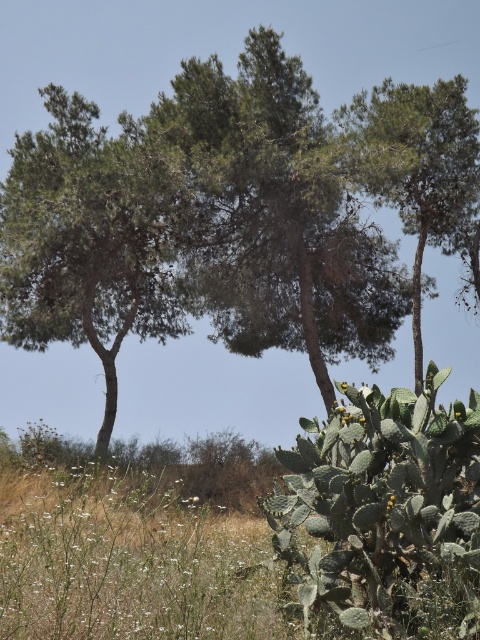
You are planning to set up a picnic area in the image. You need to choose between the space under the green leafy tree at center and the green leafy tree at upper center. Which tree would provide more shade coverage for your picnic blanket?

The green leafy tree at center might be wider than the green leafy tree at upper center, so it could provide more shade coverage for the picnic blanket.

You are standing in the middle of the landscape and want to take a photo of both the green leafy tree at center and the green leafy tree at upper center. Which tree should you focus on first if you want to capture both in the same frame?

The green leafy tree at center is bigger than the green leafy tree at upper center, so you should focus on the green leafy tree at center first to ensure it fits properly in the frame while still capturing the smaller tree in the background.